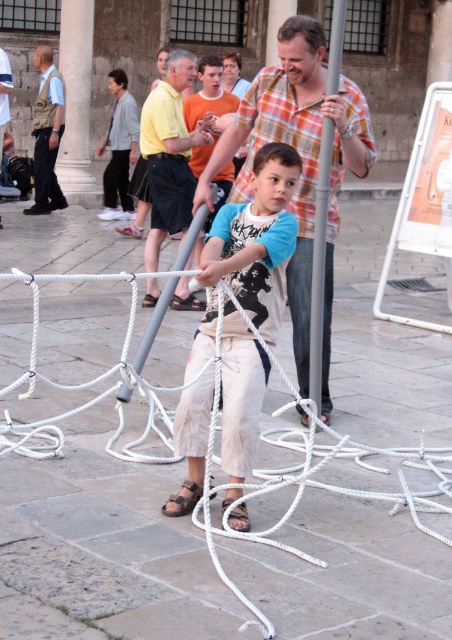
Which is in front, point (302, 61) or point (42, 106)?

Point (302, 61) is in front.

Is point (293, 262) farther from viewer compared to point (65, 205)?

No, it is in front of (65, 205).

Is point (277, 68) closer to camera compared to point (62, 208)?

Yes, it is in front of point (62, 208).

Find the location of `plaid shirt at center`. plaid shirt at center is located at coordinates (302, 164).

Describe the element at coordinates (250, 250) in the screenshot. I see `light beige cotton pants at center` at that location.

Does light beige cotton pants at center have a smaller size compared to khaki uniform at left?

Yes, light beige cotton pants at center is smaller than khaki uniform at left.

Measure the distance between point (276,321) and camera.

The distance of point (276,321) from camera is 15.26 feet.

At what (x,y) coordinates should I click in order to perform the action: click on light beige cotton pants at center. Please return your answer as a coordinate pair (x, y). Looking at the image, I should click on (250, 250).

How much distance is there between yellow cotton shirt at center and khaki uniform at left?

5.31 meters

Is yellow cotton shirt at center thinner than khaki uniform at left?

No, yellow cotton shirt at center is not thinner than khaki uniform at left.

What do you see at coordinates (169, 154) in the screenshot?
I see `yellow cotton shirt at center` at bounding box center [169, 154].

This screenshot has width=452, height=640. I want to click on yellow cotton shirt at center, so click(x=169, y=154).